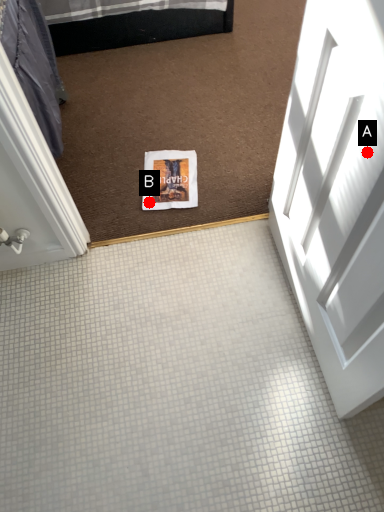
Question: Two points are circled on the image, labeled by A and B beside each circle. Which point appears farthest from the camera in this image?

Choices:
 (A) A is further
 (B) B is further

Answer: (B)